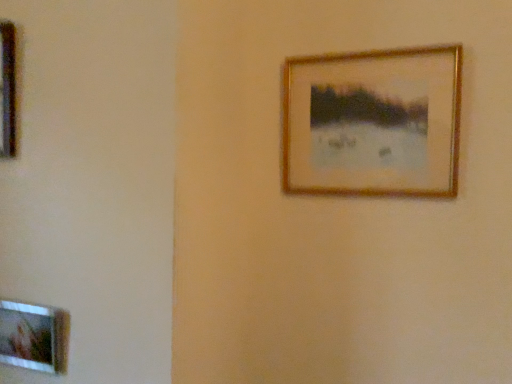
Question: From a real-world perspective, is metallic gold picture frame at left, arranged as the first picture frame when viewed from the top, on gold metallic picture frame at upper right, which appears as the 2th picture frame when ordered from the bottom?

Choices:
 (A) no
 (B) yes

Answer: (B)

Question: Is metallic gold picture frame at left, the 3th picture frame viewed from the right, not within gold metallic picture frame at upper right, which is the 3th picture frame in left-to-right order?

Choices:
 (A) yes
 (B) no

Answer: (A)

Question: Is metallic gold picture frame at left, arranged as the first picture frame when viewed from the top, taller than gold metallic picture frame at upper right, which appears as the first picture frame when viewed from the right?

Choices:
 (A) yes
 (B) no

Answer: (B)

Question: Considering the relative positions of metallic gold picture frame at left, which is the first picture frame in left-to-right order, and gold metallic picture frame at upper right, which appears as the 2th picture frame when ordered from the bottom, in the image provided, is metallic gold picture frame at left, which is the first picture frame in left-to-right order, to the left of gold metallic picture frame at upper right, which appears as the 2th picture frame when ordered from the bottom, from the viewer's perspective?

Choices:
 (A) no
 (B) yes

Answer: (B)

Question: From the image's perspective, is metallic gold picture frame at left, which appears as the 3th picture frame when ordered from the bottom, under gold metallic picture frame at upper right, which appears as the first picture frame when viewed from the right?

Choices:
 (A) yes
 (B) no

Answer: (B)

Question: From the image's perspective, is gold metallic picture frame at upper right, which appears as the first picture frame when viewed from the right, located above or below wooden picture frame at lower left, which ranks as the 2th picture frame in right-to-left order?

Choices:
 (A) below
 (B) above

Answer: (B)

Question: From their relative heights in the image, would you say gold metallic picture frame at upper right, which appears as the first picture frame when viewed from the right, is taller or shorter than wooden picture frame at lower left, acting as the 1th picture frame starting from the bottom?

Choices:
 (A) short
 (B) tall

Answer: (B)

Question: Is gold metallic picture frame at upper right, placed as the 2th picture frame when sorted from top to bottom, in front of or behind wooden picture frame at lower left, acting as the 1th picture frame starting from the bottom, in the image?

Choices:
 (A) front
 (B) behind

Answer: (B)

Question: From a real-world perspective, is gold metallic picture frame at upper right, which is the 3th picture frame in left-to-right order, physically located above or below wooden picture frame at lower left, acting as the 1th picture frame starting from the bottom?

Choices:
 (A) below
 (B) above

Answer: (B)

Question: Considering the positions of wooden picture frame at lower left, which ranks as the 2th picture frame in right-to-left order, and gold metallic picture frame at upper right, which appears as the first picture frame when viewed from the right, in the image, is wooden picture frame at lower left, which ranks as the 2th picture frame in right-to-left order, bigger or smaller than gold metallic picture frame at upper right, which appears as the first picture frame when viewed from the right,?

Choices:
 (A) small
 (B) big

Answer: (A)

Question: From the image's perspective, is wooden picture frame at lower left, acting as the 1th picture frame starting from the bottom, located above or below gold metallic picture frame at upper right, which appears as the first picture frame when viewed from the right?

Choices:
 (A) above
 (B) below

Answer: (B)

Question: Is point (12, 319) positioned closer to the camera than point (349, 132)?

Choices:
 (A) farther
 (B) closer

Answer: (B)

Question: From a real-world perspective, relative to gold metallic picture frame at upper right, which appears as the 2th picture frame when ordered from the bottom, is wooden picture frame at lower left, arranged as the third picture frame when viewed from the top, vertically above or below?

Choices:
 (A) below
 (B) above

Answer: (A)

Question: Considering the positions of metallic gold picture frame at left, which is the first picture frame in left-to-right order, and wooden picture frame at lower left, marked as the second picture frame in a left-to-right arrangement, in the image, is metallic gold picture frame at left, which is the first picture frame in left-to-right order, bigger or smaller than wooden picture frame at lower left, marked as the second picture frame in a left-to-right arrangement,?

Choices:
 (A) small
 (B) big

Answer: (B)

Question: Is point (2, 56) positioned closer to the camera than point (56, 345)?

Choices:
 (A) farther
 (B) closer

Answer: (B)